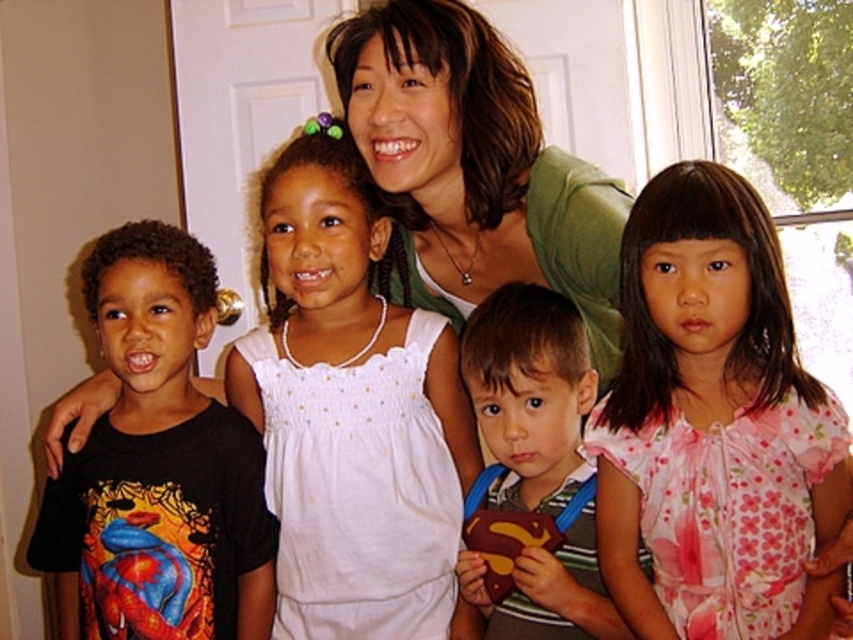
Consider the image. Is white cotton dress at center to the left of green fabric shirt at center from the viewer's perspective?

Correct, you'll find white cotton dress at center to the left of green fabric shirt at center.

What do you see at coordinates (352, 412) in the screenshot? I see `white cotton dress at center` at bounding box center [352, 412].

Locate an element on the screen. This screenshot has width=853, height=640. white cotton dress at center is located at coordinates (352, 412).

Looking at this image, does black t-shirt at left have a lesser width compared to green fabric shirt at center?

Yes.

Does point (213, 465) come behind point (496, 225)?

Yes, point (213, 465) is behind point (496, 225).

Does point (143, 436) come behind point (566, 212)?

Yes, point (143, 436) is farther from viewer.

Locate an element on the screen. The image size is (853, 640). black t-shirt at left is located at coordinates (160, 464).

Can you confirm if green fabric shirt at center is positioned below matte brown plush toy at center?

Incorrect, green fabric shirt at center is not positioned below matte brown plush toy at center.

Who is positioned more to the left, green fabric shirt at center or matte brown plush toy at center?

Positioned to the left is green fabric shirt at center.

What do you see at coordinates (476, 164) in the screenshot? Image resolution: width=853 pixels, height=640 pixels. I see `green fabric shirt at center` at bounding box center [476, 164].

This screenshot has height=640, width=853. Find the location of `green fabric shirt at center`. green fabric shirt at center is located at coordinates (476, 164).